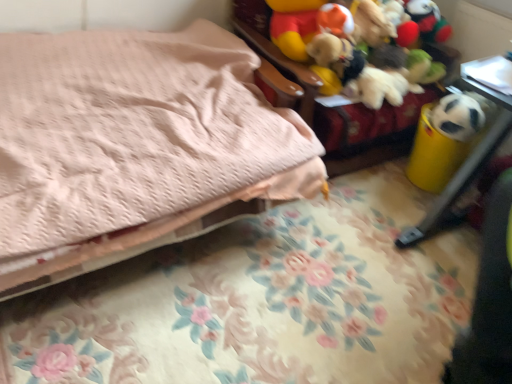
I want to click on vacant space situated on the left part of yellow plastic trash can at right, the 1th furniture from the bottom, so click(362, 252).